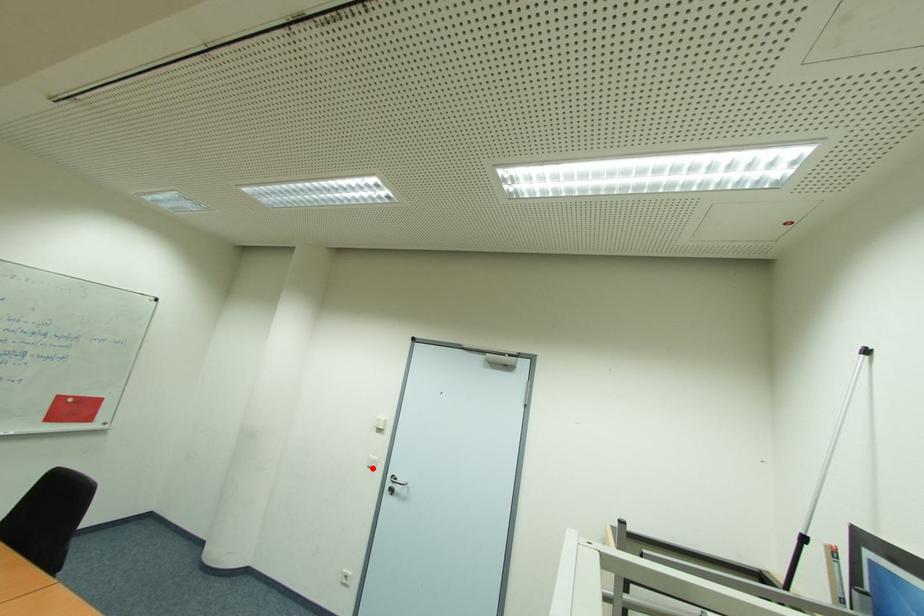
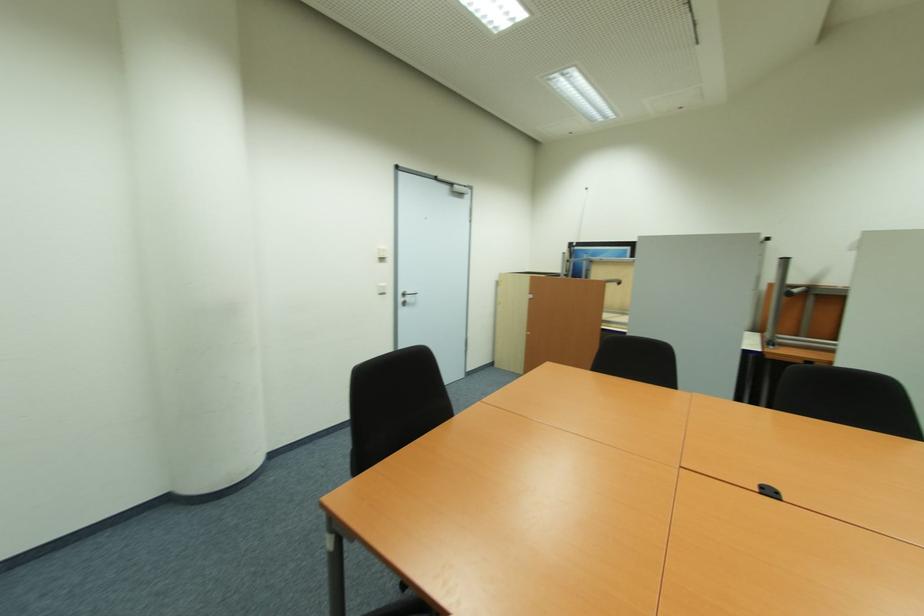
Where in the second image is the point corresponding to the highlighted location from the first image?

(383, 294)